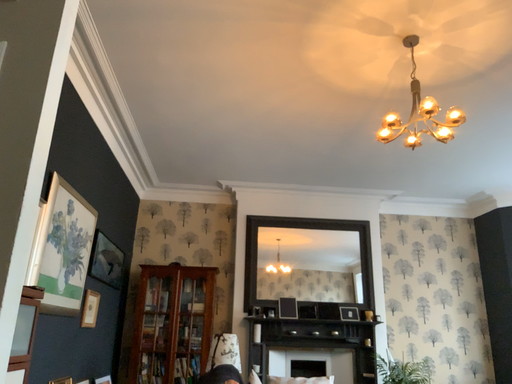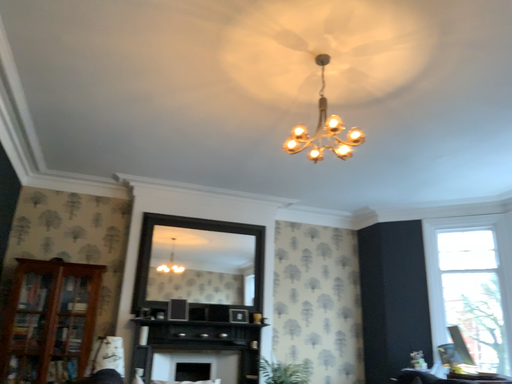
Question: Which way did the camera rotate in the video?

Choices:
 (A) rotated right
 (B) rotated left

Answer: (A)